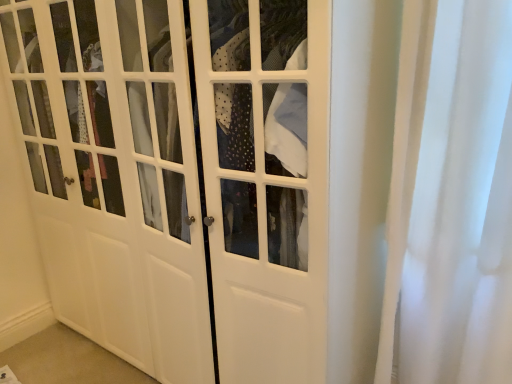
Where is `white matte closet doors at center`? The image size is (512, 384). white matte closet doors at center is located at coordinates (179, 177).

Image resolution: width=512 pixels, height=384 pixels. Describe the element at coordinates (179, 177) in the screenshot. I see `white matte closet doors at center` at that location.

Find the location of a particular element. This screenshot has height=384, width=512. white matte closet doors at center is located at coordinates (179, 177).